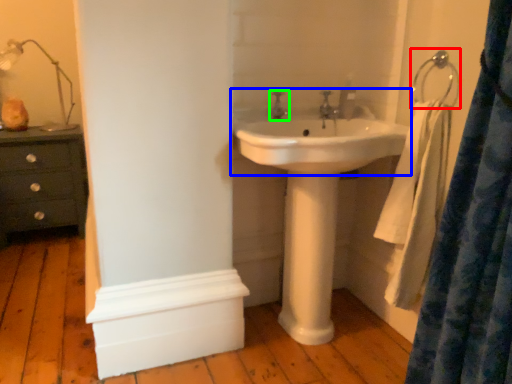
Question: Which is nearer to the hang (highlighted by a red box)? sink (highlighted by a blue box) or tap (highlighted by a green box).

Choices:
 (A) sink
 (B) tap

Answer: (A)